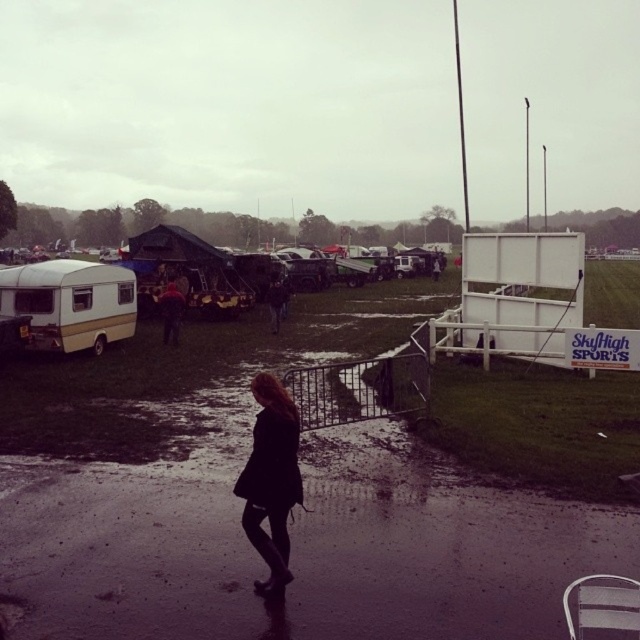
You are navigating a small drone that needs to fly from the person walking away from the camera to the gold metallic caravan at left. Given the coordinates provided in the Objects Description, can the drone safely reach the caravan without passing over the wet muddy ground?

The gold metallic caravan at left is located at point (70, 301), so the drone can safely fly from the person to the caravan without needing to pass over the wet muddy ground as it can navigate through the air.

You are at the fairground and want to find the gold metallic caravan at left. According to the coordinates provided, where should you look relative to your current position?

The gold metallic caravan at left is located at point coordinates 0.473 on the x axis and 0.111 on the y axis, so you should look towards the left side of the scene where the caravan is positioned.

You are standing at the point labeled point (x=112, y=289) and want to walk to the point labeled point (x=177, y=342). Given that the ground between them is muddy and slippery, which direction should you move to reach your destination safely?

You should move forward because point (x=112, y=289) is closer to the viewer than point (x=177, y=342), so moving forward in the direction away from the viewer will lead you towards the destination safely.